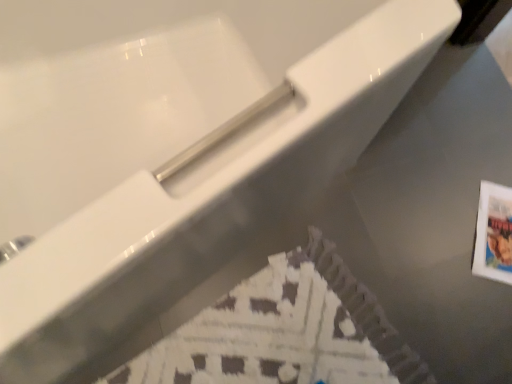
You are a GUI agent. You are given a task and a screenshot of the screen. Output one action in this format:
    pyautogui.click(x=<x>, y=<y>)
    Task: Click on the blank space situated above white paper flyer at lower center (from a real-world perspective)
    Image resolution: width=512 pixels, height=384 pixels.
    Given the screenshot: What is the action you would take?
    pyautogui.click(x=274, y=340)